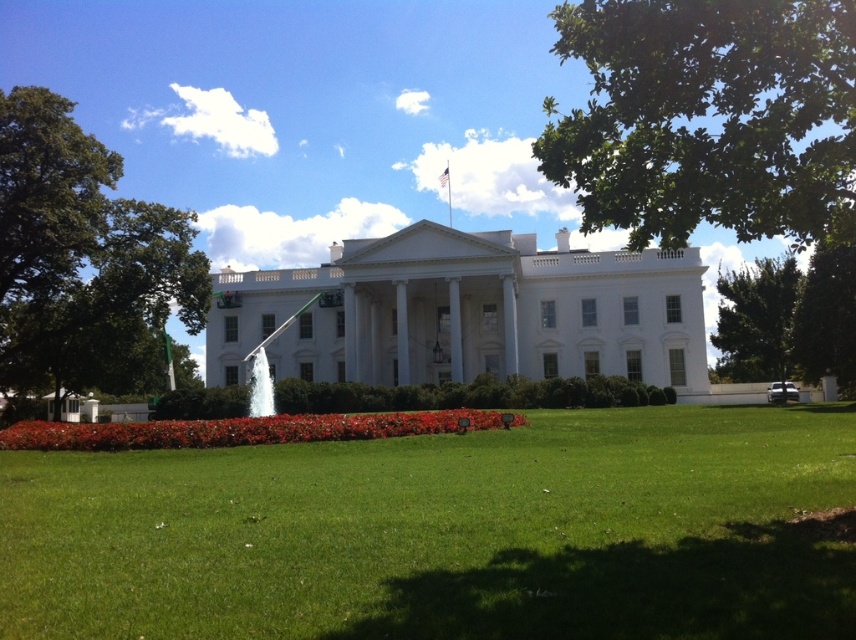
You are standing in front of the grand white building and want to determine the relative positions of two points marked in the scene. Which point, point (153,460) or point (765,352), is closer to you?

Point (153,460) is closer to the viewer than point (765,352).

Consider the image. You are a gardener planning to mow the green grass at center and trim the green leafy tree at right. Based on their current heights, which task should you prioritize first?

The green grass at center is shorter than the green leafy tree at right, so you should prioritize trimming the green leafy tree at right first since it requires a higher reach and specialized tools before mowing the shorter grass.

You are standing in front of the grand white building and want to take a photo that includes both the green leafy tree at upper right and the green leafy tree at left. Which tree should you position closer to the center of your camera frame to ensure both are fully visible?

The green leafy tree at upper right might be wider than the green leafy tree at left, so positioning the wider tree closer to the center of the camera frame would help ensure both are fully visible in the photo.